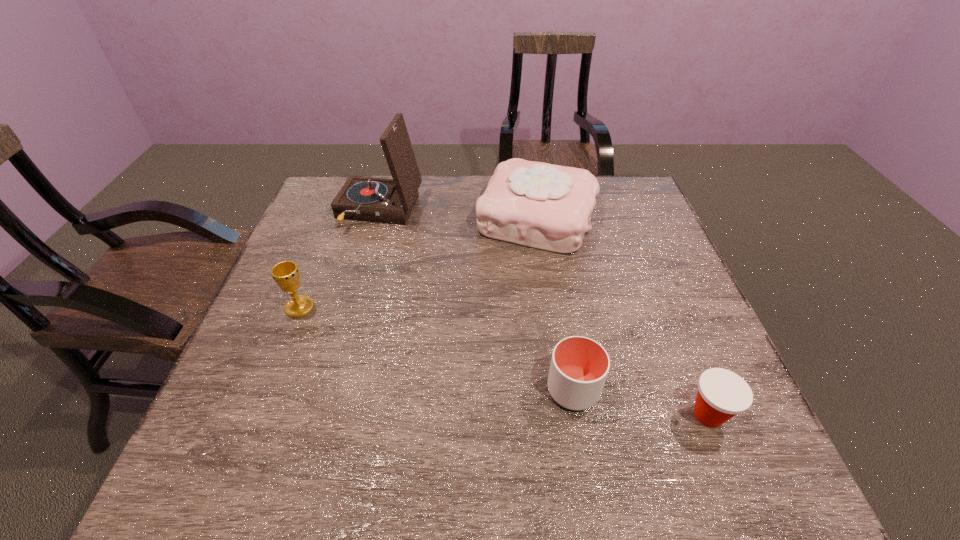
Find the location of `free space between the phonograph record and the cake`. free space between the phonograph record and the cake is located at coordinates (458, 214).

Locate an element on the screen. Image resolution: width=960 pixels, height=540 pixels. free spot between the third nearest object and the shortest object is located at coordinates (504, 361).

Choose which object is the third nearest neighbor to the chalice. Please provide its 2D coordinates. Your answer should be formatted as a tuple, i.e. [(x, y)], where the tuple contains the x and y coordinates of a point satisfying the conditions above.

[(579, 366)]

The width and height of the screenshot is (960, 540). I want to click on object that is the fourth closest to the cake, so click(722, 394).

Image resolution: width=960 pixels, height=540 pixels. I want to click on vacant space that satisfies the following two spatial constraints: 1. on the front side of the cup; 2. on the left side of the tallest object, so click(329, 390).

This screenshot has height=540, width=960. I want to click on vacant space that satisfies the following two spatial constraints: 1. on the front side of the cup; 2. on the left side of the Dixie cup, so click(x=578, y=415).